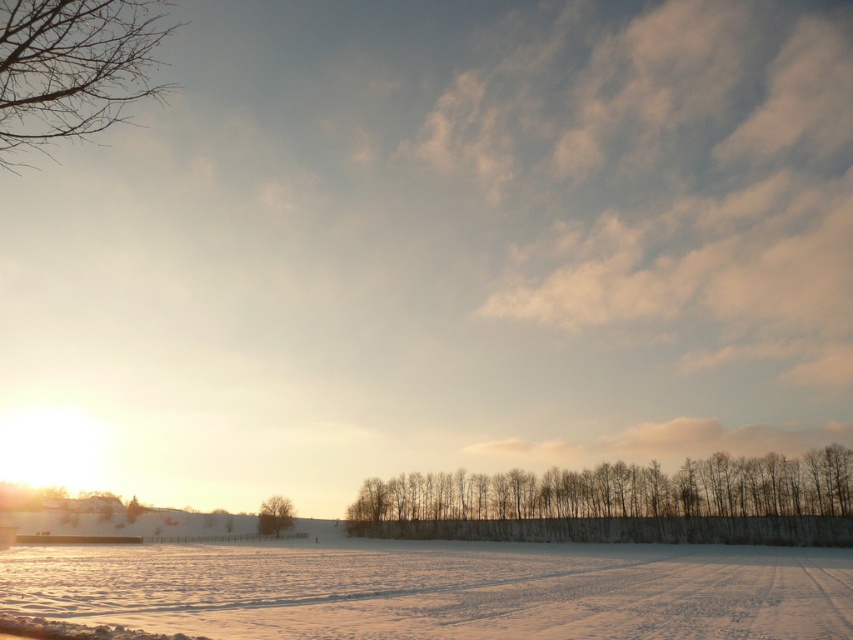
You are standing in the winter landscape and want to walk from the bare branches at upper left to the white powdery snow at lower center. Which direction should you move to reach the snow?

You should move to the right to reach the white powdery snow at lower center because it is located to the right of the bare branches at upper left.

You are a snowmobile rider planning to cross the white powdery snow at lower center and the green matte tree at center. Which area should you avoid to prevent sinking into the snow?

You should avoid the white powdery snow at lower center because it is larger in size than the green matte tree at center, indicating it might be deeper or less compacted, leading to sinking.

You are standing in the winter landscape and want to walk to the point marked at coordinates point (x=442, y=563) and point (x=283, y=512). Which point should you head towards if you want to reach the one that is closer to your current position?

You should head towards point (x=442, y=563) because it is closer to the viewer than point (x=283, y=512) according to the description.